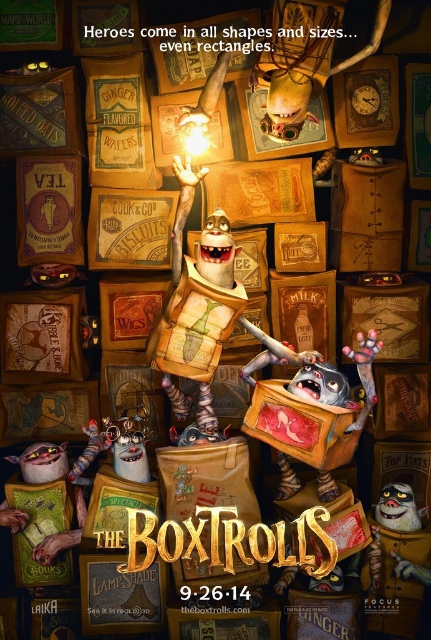
Does shiny metallic toy at bottom right have a lesser height compared to fluffy white pillow at lower left?

In fact, shiny metallic toy at bottom right may be taller than fluffy white pillow at lower left.

Who is positioned more to the left, shiny metallic toy at bottom right or fluffy white pillow at lower left?

From the viewer's perspective, fluffy white pillow at lower left appears more on the left side.

Who is more forward, (369, 616) or (56, 468)?

Point (369, 616) is in front.

Locate an element on the screen. Image resolution: width=431 pixels, height=640 pixels. shiny metallic toy at bottom right is located at coordinates (399, 563).

Is shiny metallic toy at center thinner than fluffy white pillow at lower left?

No.

Consider the image. Is shiny metallic toy at center to the left of fluffy white pillow at lower left from the viewer's perspective?

Incorrect, shiny metallic toy at center is not on the left side of fluffy white pillow at lower left.

Describe the element at coordinates (337, 403) in the screenshot. The image size is (431, 640). I see `shiny metallic toy at center` at that location.

The height and width of the screenshot is (640, 431). Identify the location of shiny metallic toy at center. (337, 403).

Does wooden book at center have a greater width compared to shiny metallic toy at center?

Yes.

You are a GUI agent. You are given a task and a screenshot of the screen. Output one action in this format:
    pyautogui.click(x=<x>, y=<y>)
    Task: Click on the wooden book at center
    Image resolution: width=431 pixels, height=640 pixels.
    Given the screenshot: What is the action you would take?
    pyautogui.click(x=203, y=308)

The image size is (431, 640). Find the location of `wooden book at center`. wooden book at center is located at coordinates (203, 308).